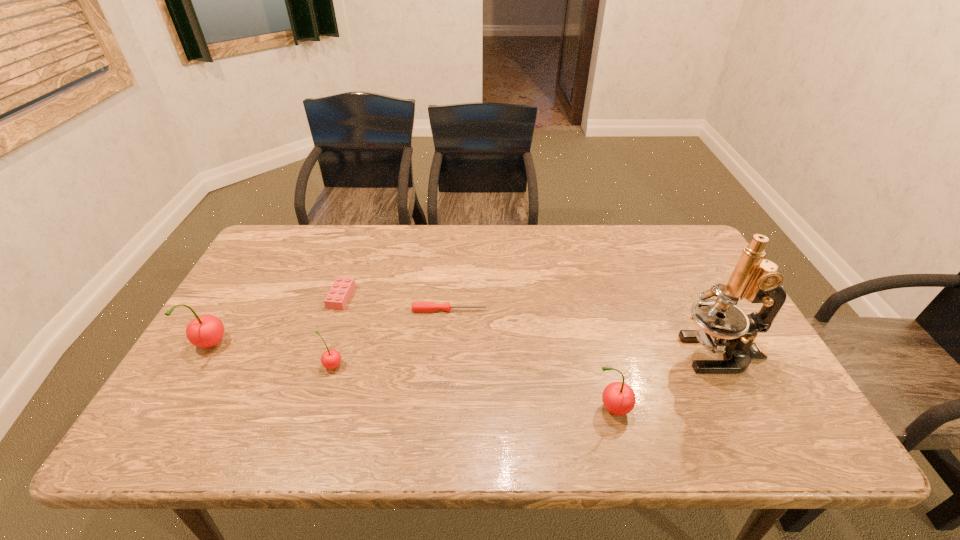
This screenshot has height=540, width=960. In order to click on vacant area that lies between the rightmost object and the second object from right to left in this screenshot , I will do `click(665, 381)`.

Locate an element on the screen. vacant space in between the third object from right to left and the nearest object is located at coordinates (530, 360).

I want to click on vacant area that lies between the leftmost object and the second cherry from right to left, so click(272, 356).

You are a GUI agent. You are given a task and a screenshot of the screen. Output one action in this format:
    pyautogui.click(x=<x>, y=<y>)
    Task: Click on the free spot between the Lego and the nearest cherry
    The image size is (960, 540).
    Given the screenshot: What is the action you would take?
    pyautogui.click(x=476, y=353)

The width and height of the screenshot is (960, 540). I want to click on empty space between the leftmost cherry and the third shortest object, so click(272, 356).

This screenshot has height=540, width=960. I want to click on free space that is in between the nearest object and the screwdriver, so click(x=530, y=360).

Locate an element on the screen. The height and width of the screenshot is (540, 960). unoccupied area between the fourth object from left to right and the shortest cherry is located at coordinates (391, 338).

Identify which object is the closest to the leftmost object. Please provide its 2D coordinates. Your answer should be formatted as a tuple, i.e. [(x, y)], where the tuple contains the x and y coordinates of a point satisfying the conditions above.

[(338, 296)]

Locate an element on the screen. the closest object relative to the tallest object is located at coordinates (618, 398).

You are a GUI agent. You are given a task and a screenshot of the screen. Output one action in this format:
    pyautogui.click(x=<x>, y=<y>)
    Task: Click on the cherry that stands as the second closest to the microscope
    Image resolution: width=960 pixels, height=540 pixels.
    Given the screenshot: What is the action you would take?
    pyautogui.click(x=330, y=359)